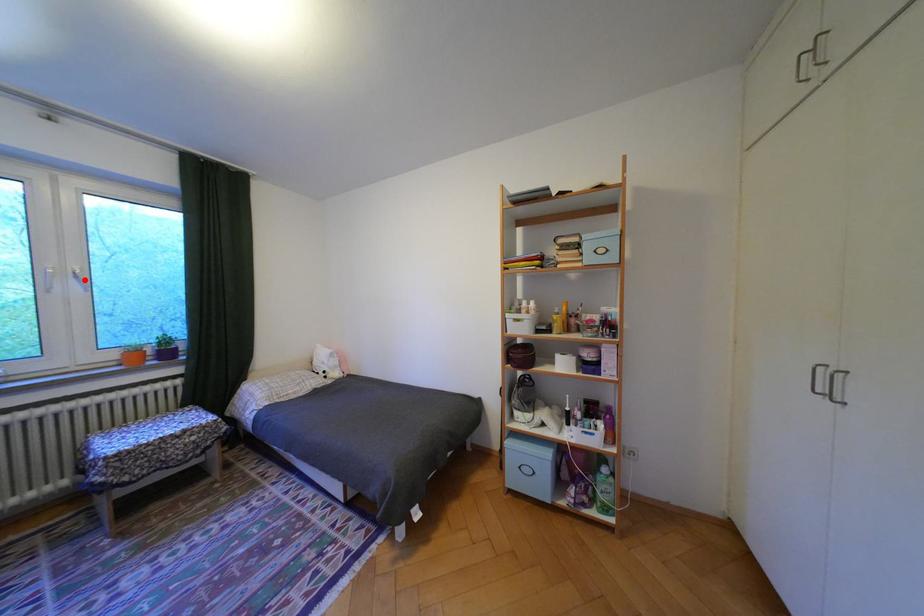
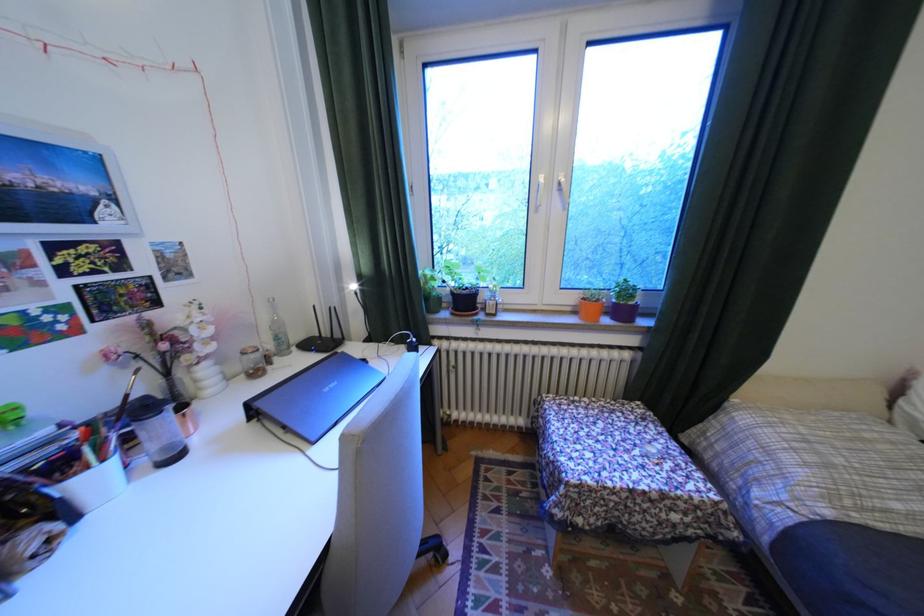
Find the pixel in the second image that matches the highlighted location in the first image.

(566, 195)